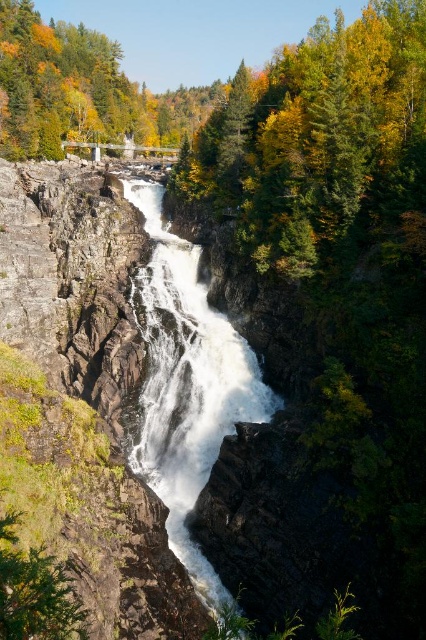
Question: Which point is farther to the camera?

Choices:
 (A) (204, 477)
 (B) (388, 161)

Answer: (B)

Question: Is the position of green leafy tree at upper center more distant than that of white frothy water at center?

Choices:
 (A) no
 (B) yes

Answer: (B)

Question: Which point appears closest to the camera in this image?

Choices:
 (A) (164, 451)
 (B) (345, 113)

Answer: (A)

Question: Is green leafy tree at upper center closer to the viewer compared to white frothy water at center?

Choices:
 (A) no
 (B) yes

Answer: (A)

Question: Which of the following is the farthest from the observer?

Choices:
 (A) (382, 8)
 (B) (184, 356)

Answer: (A)

Question: Does green leafy tree at upper center have a lesser width compared to white frothy water at center?

Choices:
 (A) yes
 (B) no

Answer: (B)